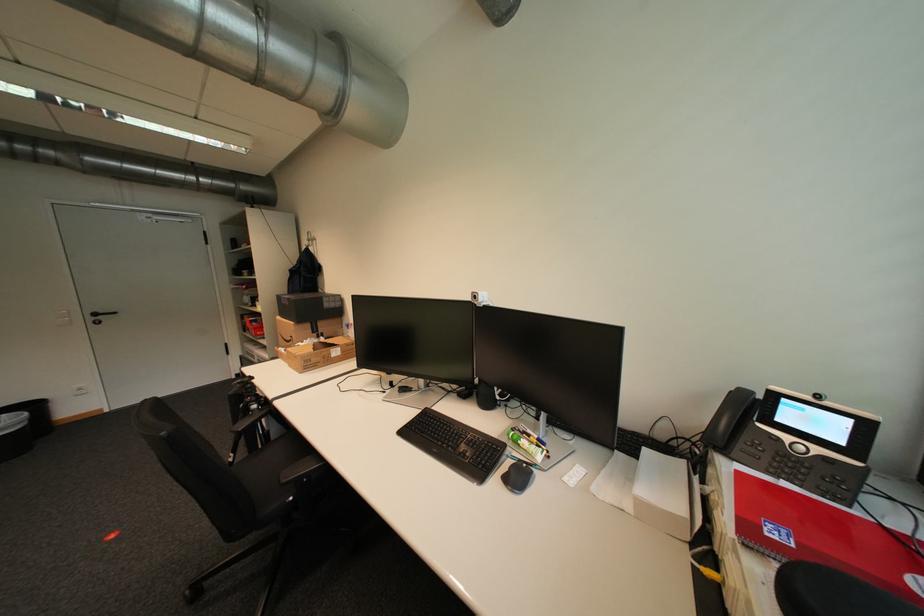
Where is `phone handset`? phone handset is located at coordinates click(754, 438).